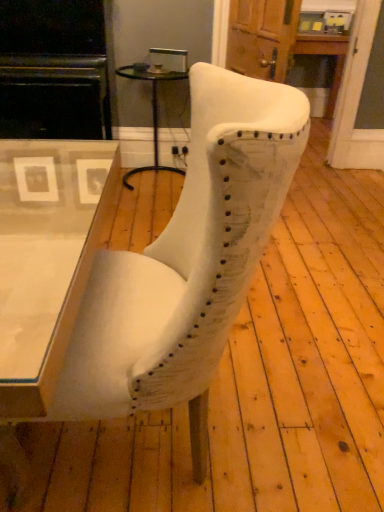
Question: Relative to white fabric chair at center, is black glass side table at center in front or behind?

Choices:
 (A) front
 (B) behind

Answer: (B)

Question: From their relative heights in the image, would you say black glass side table at center is taller or shorter than white fabric chair at center?

Choices:
 (A) tall
 (B) short

Answer: (B)

Question: Estimate the real-world distances between objects in this image. Which object is farther from the white fabric chair at center?

Choices:
 (A) matte black entertainment center at left
 (B) black glass side table at center

Answer: (B)

Question: Which is farther from the matte black entertainment center at left?

Choices:
 (A) black glass side table at center
 (B) white fabric chair at center

Answer: (B)